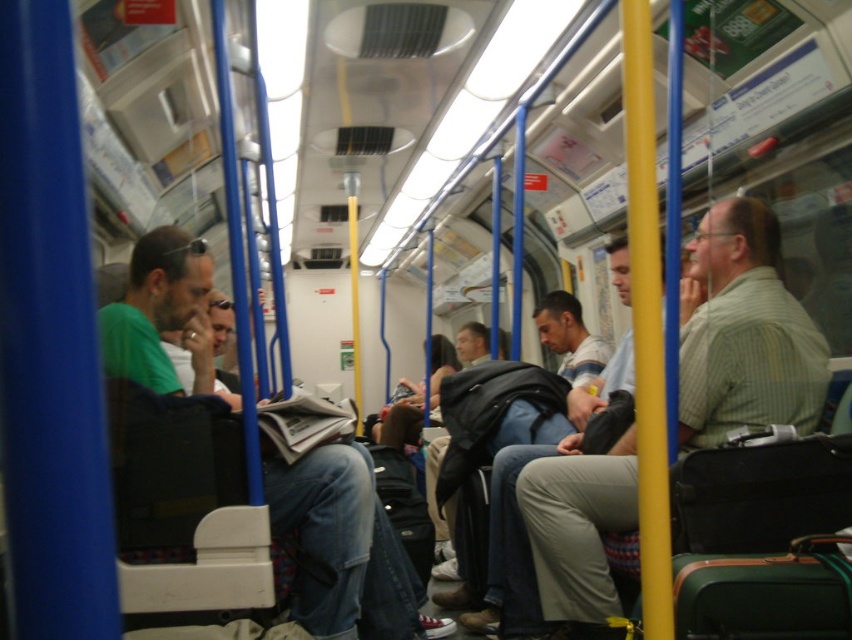
You are a GUI agent. You are given a task and a screenshot of the screen. Output one action in this format:
    pyautogui.click(x=<x>, y=<y>)
    Task: Click on the light green striped shirt at right
    This screenshot has width=852, height=640.
    Given the screenshot: What is the action you would take?
    pyautogui.click(x=743, y=332)

From the picture: Is light green striped shirt at right thinner than green cotton shirt at left?

Yes, light green striped shirt at right is thinner than green cotton shirt at left.

Measure the distance between light green striped shirt at right and camera.

A distance of 6.41 feet exists between light green striped shirt at right and camera.

You are a GUI agent. You are given a task and a screenshot of the screen. Output one action in this format:
    pyautogui.click(x=<x>, y=<y>)
    Task: Click on the light green striped shirt at right
    This screenshot has width=852, height=640.
    Given the screenshot: What is the action you would take?
    pyautogui.click(x=743, y=332)

Is point (556, 296) less distant than point (371, 433)?

Yes, point (556, 296) is closer to viewer.

Where is `matte gray backpack at center`? This screenshot has width=852, height=640. matte gray backpack at center is located at coordinates (568, 337).

Does point (562, 349) lie in front of point (432, 403)?

Yes.

The image size is (852, 640). Identify the location of matte gray backpack at center. (568, 337).

Does point (701, 380) come farther from viewer compared to point (403, 396)?

No, it is not.

What do you see at coordinates (743, 332) in the screenshot? The width and height of the screenshot is (852, 640). I see `light green striped shirt at right` at bounding box center [743, 332].

The width and height of the screenshot is (852, 640). I want to click on light green striped shirt at right, so click(743, 332).